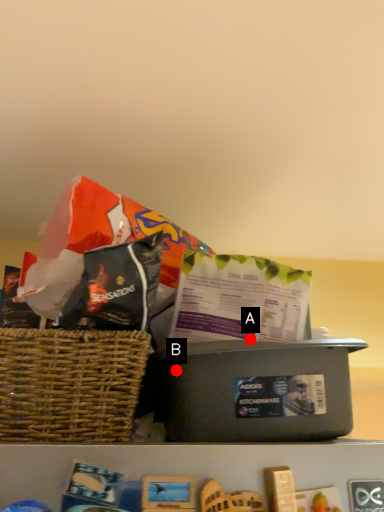
Question: Two points are circled on the image, labeled by A and B beside each circle. Which of the following is the closest to the observer?

Choices:
 (A) A is closer
 (B) B is closer

Answer: (B)